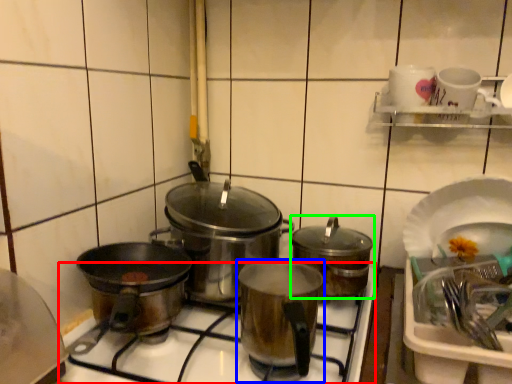
Question: Which is farther away from gas stove (highlighted by a red box)? kitchen appliance (highlighted by a blue box) or kitchen appliance (highlighted by a green box)?

Choices:
 (A) kitchen appliance
 (B) kitchen appliance

Answer: (B)